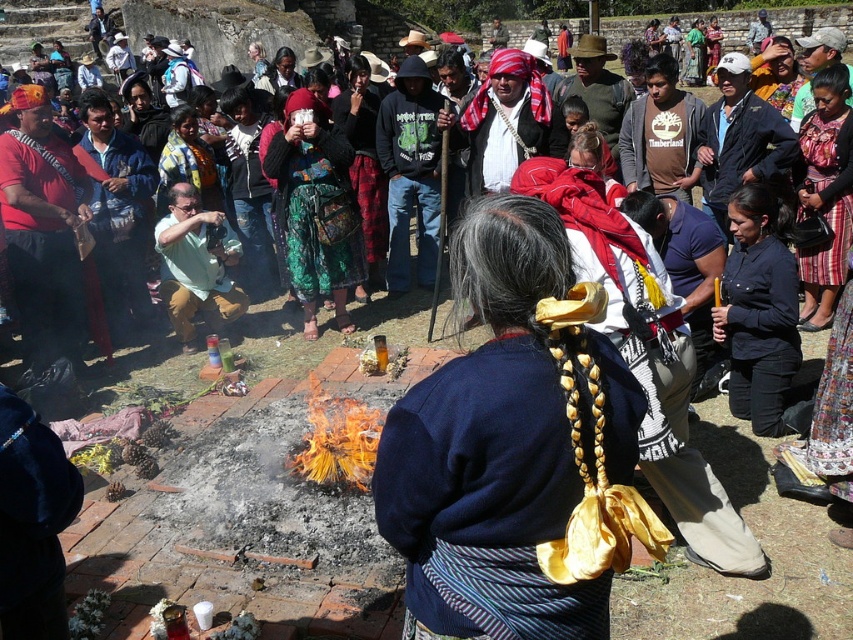
Question: Observing the image, what is the correct spatial positioning of multicolored woven skirt at center in reference to green matte shirt at center?

Choices:
 (A) left
 (B) right

Answer: (B)

Question: Which of the following is the farthest from the observer?

Choices:
 (A) multicolored woven skirt at center
 (B) dark blue sweater at center
 (C) green matte shirt at center

Answer: (C)

Question: Which point is closer to the camera taking this photo?

Choices:
 (A) (169, 276)
 (B) (492, 252)
 (C) (289, 241)

Answer: (B)

Question: Is dark blue sweater at center to the right of multicolored woven skirt at center from the viewer's perspective?

Choices:
 (A) no
 (B) yes

Answer: (B)

Question: Where is dark blue sweater at center located in relation to green matte shirt at center in the image?

Choices:
 (A) right
 (B) left

Answer: (A)

Question: Considering the real-world distances, which object is closest to the multicolored woven skirt at center?

Choices:
 (A) green matte shirt at center
 (B) dark blue sweater at center

Answer: (A)